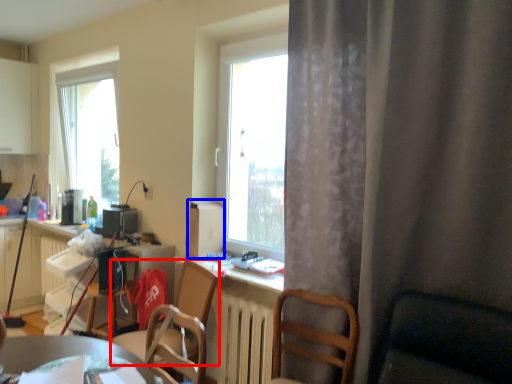
Question: Which point is closer to the camera, chair (highlighted by a red box) or appliance (highlighted by a blue box)?

Choices:
 (A) chair
 (B) appliance

Answer: (A)